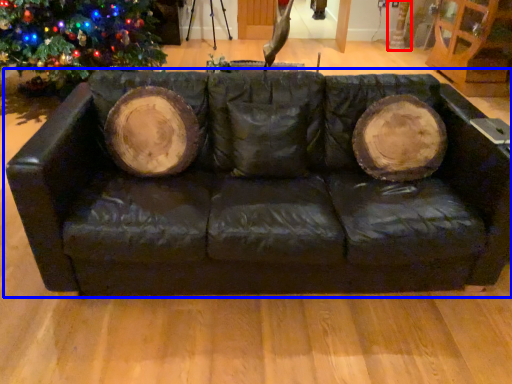
Question: Which point is closer to the camera, tree trunk (highlighted by a red box) or studio couch (highlighted by a blue box)?

Choices:
 (A) tree trunk
 (B) studio couch

Answer: (B)